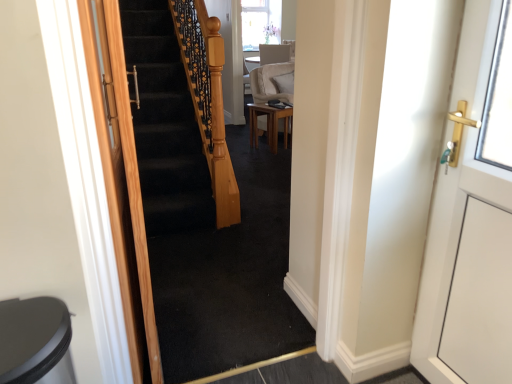
Question: Is white glossy door at right, arranged as the first door when viewed from the right, at the right side of light brown wooden table at center?

Choices:
 (A) yes
 (B) no

Answer: (A)

Question: Can you confirm if white glossy door at right, arranged as the first door when viewed from the right, is bigger than light brown wooden table at center?

Choices:
 (A) yes
 (B) no

Answer: (B)

Question: Can you confirm if white glossy door at right, arranged as the first door when viewed from the right, is positioned to the left of light brown wooden table at center?

Choices:
 (A) no
 (B) yes

Answer: (A)

Question: Is white glossy door at right, the 2th door from the left, far away from light brown wooden table at center?

Choices:
 (A) no
 (B) yes

Answer: (B)

Question: Can you confirm if white glossy door at right, the 2th door from the left, is wider than light brown wooden table at center?

Choices:
 (A) yes
 (B) no

Answer: (B)

Question: Is white glossy door at right, arranged as the first door when viewed from the right, directly adjacent to light brown wooden table at center?

Choices:
 (A) no
 (B) yes

Answer: (A)

Question: Can you see light brown wooden table at center touching black carpeted stairs at center?

Choices:
 (A) yes
 (B) no

Answer: (B)

Question: Considering the relative positions of light brown wooden table at center and black carpeted stairs at center in the image provided, is light brown wooden table at center behind black carpeted stairs at center?

Choices:
 (A) no
 (B) yes

Answer: (B)

Question: From the image's perspective, would you say light brown wooden table at center is shown under black carpeted stairs at center?

Choices:
 (A) yes
 (B) no

Answer: (B)

Question: Is black carpeted stairs at center inside light brown wooden table at center?

Choices:
 (A) no
 (B) yes

Answer: (A)

Question: Considering the relative sizes of light brown wooden table at center and black carpeted stairs at center in the image provided, is light brown wooden table at center taller than black carpeted stairs at center?

Choices:
 (A) no
 (B) yes

Answer: (A)

Question: Does light brown wooden table at center turn towards black carpeted stairs at center?

Choices:
 (A) no
 (B) yes

Answer: (A)

Question: Is white glossy door at right, the 2th door from the left, oriented away from wooden door at left, placed as the first door when sorted from left to right?

Choices:
 (A) no
 (B) yes

Answer: (A)